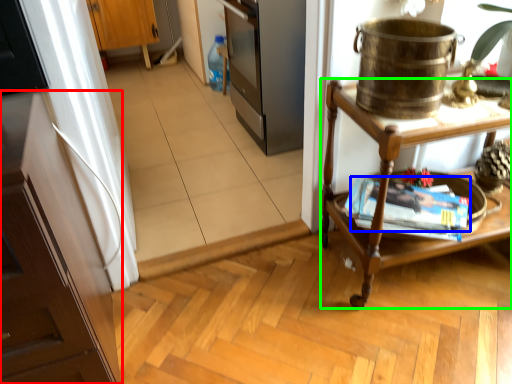
Question: Considering the real-world distances, which object is farthest from cabinetry (highlighted by a red box)? magazine (highlighted by a blue box) or desk (highlighted by a green box)?

Choices:
 (A) magazine
 (B) desk

Answer: (A)